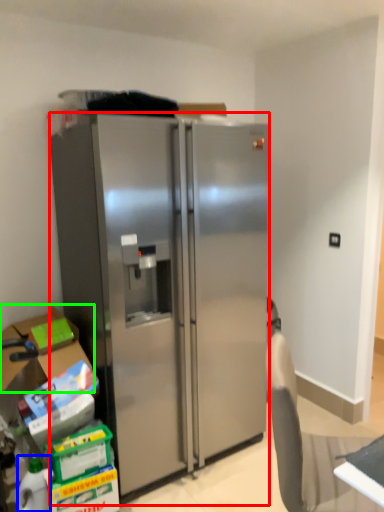
Question: Considering the real-world distances, which object is farthest from refrigerator (highlighted by a red box)? bottle (highlighted by a blue box) or box (highlighted by a green box)?

Choices:
 (A) bottle
 (B) box

Answer: (A)